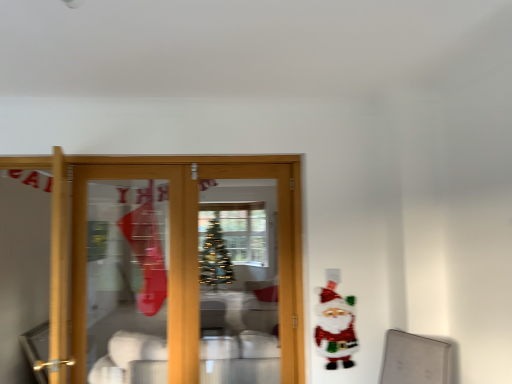
Question: Should I look upward or downward to see white glossy bowls at center?

Choices:
 (A) down
 (B) up

Answer: (A)

Question: From the image's perspective, is white glossy bowls at center above shiny sequined santa claus at right?

Choices:
 (A) no
 (B) yes

Answer: (A)

Question: Is the depth of white glossy bowls at center less than that of shiny sequined santa claus at right?

Choices:
 (A) yes
 (B) no

Answer: (B)

Question: Are white glossy bowls at center and shiny sequined santa claus at right beside each other?

Choices:
 (A) no
 (B) yes

Answer: (A)

Question: Is white glossy bowls at center wider than shiny sequined santa claus at right?

Choices:
 (A) no
 (B) yes

Answer: (B)

Question: Does white glossy bowls at center lie behind shiny sequined santa claus at right?

Choices:
 (A) yes
 (B) no

Answer: (A)

Question: Considering the relative sizes of white glossy bowls at center and shiny sequined santa claus at right in the image provided, is white glossy bowls at center taller than shiny sequined santa claus at right?

Choices:
 (A) yes
 (B) no

Answer: (A)

Question: Is shiny sequined santa claus at right thinner than white glossy bowls at center?

Choices:
 (A) no
 (B) yes

Answer: (B)

Question: Is shiny sequined santa claus at right bigger than white glossy bowls at center?

Choices:
 (A) no
 (B) yes

Answer: (A)

Question: From a real-world perspective, is shiny sequined santa claus at right positioned over white glossy bowls at center based on gravity?

Choices:
 (A) no
 (B) yes

Answer: (B)

Question: Are shiny sequined santa claus at right and white glossy bowls at center beside each other?

Choices:
 (A) yes
 (B) no

Answer: (B)

Question: From the image's perspective, is shiny sequined santa claus at right over white glossy bowls at center?

Choices:
 (A) yes
 (B) no

Answer: (A)

Question: Is white glossy bowls at center surrounded by shiny sequined santa claus at right?

Choices:
 (A) yes
 (B) no

Answer: (B)

Question: Is white glossy bowls at center wider or thinner than shiny sequined santa claus at right?

Choices:
 (A) wide
 (B) thin

Answer: (A)